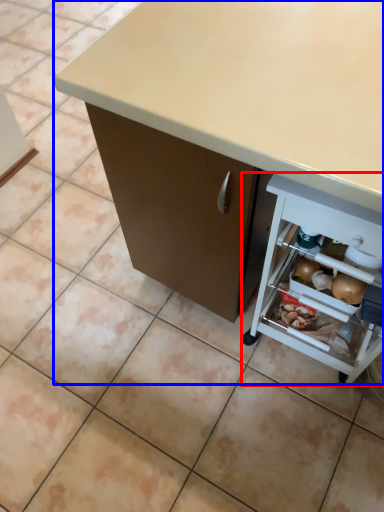
Question: Among these objects, which one is nearest to the camera, shelf (highlighted by a red box) or desk (highlighted by a blue box)?

Choices:
 (A) shelf
 (B) desk

Answer: (B)